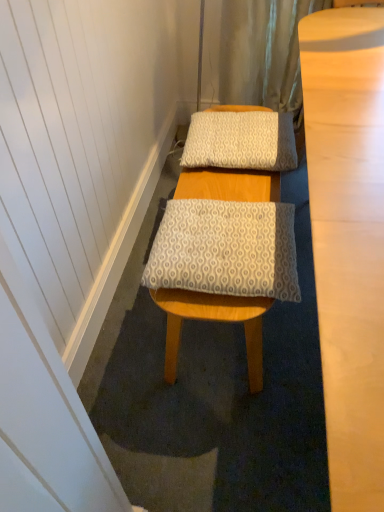
This screenshot has width=384, height=512. What do you see at coordinates (225, 249) in the screenshot?
I see `patterned fabric pillow at center, acting as the second pillow starting from the back` at bounding box center [225, 249].

Where is `patterned fabric pillow at center, the second pillow positioned from the top`? patterned fabric pillow at center, the second pillow positioned from the top is located at coordinates (225, 249).

Is patterned fabric pillow at center, acting as the second pillow starting from the back, at the back of white textured pillow at center, which is the 2th pillow from bottom to top?

white textured pillow at center, which is the 2th pillow from bottom to top, does not have its back to patterned fabric pillow at center, acting as the second pillow starting from the back.

Which of these two, white textured pillow at center, the first pillow in the top-to-bottom sequence, or patterned fabric pillow at center, marked as the 1th pillow in a bottom-to-top arrangement, is thinner?

With smaller width is patterned fabric pillow at center, marked as the 1th pillow in a bottom-to-top arrangement.

From the image's perspective, is white textured pillow at center, acting as the 2th pillow starting from the front, positioned above or below patterned fabric pillow at center, acting as the second pillow starting from the back?

white textured pillow at center, acting as the 2th pillow starting from the front, is above patterned fabric pillow at center, acting as the second pillow starting from the back.

Which object is further away from the camera taking this photo, white textured pillow at center, which is the 2th pillow from bottom to top, or patterned fabric pillow at center, the first pillow when ordered from front to back?

Positioned behind is white textured pillow at center, which is the 2th pillow from bottom to top.

Would you say white textured bath mat at center is inside or outside white textured pillow at center, which is the 1th pillow from back to front?

white textured bath mat at center cannot be found inside white textured pillow at center, which is the 1th pillow from back to front.

Which of these two, white textured bath mat at center or white textured pillow at center, the first pillow in the top-to-bottom sequence, is bigger?

white textured bath mat at center is bigger.

Between white textured bath mat at center and white textured pillow at center, the first pillow in the top-to-bottom sequence, which one appears on the left side from the viewer's perspective?

Positioned to the left is white textured pillow at center, the first pillow in the top-to-bottom sequence.

Is point (193, 272) in front of point (302, 173)?

That is True.

Is white textured bath mat at center a part of patterned fabric pillow at center, the second pillow positioned from the top?

No, white textured bath mat at center is not surrounded by patterned fabric pillow at center, the second pillow positioned from the top.

Could you tell me if patterned fabric pillow at center, marked as the 1th pillow in a bottom-to-top arrangement, is turned towards white textured bath mat at center?

No, patterned fabric pillow at center, marked as the 1th pillow in a bottom-to-top arrangement, does not turn towards white textured bath mat at center.

In terms of width, does patterned fabric pillow at center, the first pillow when ordered from front to back, look wider or thinner when compared to white textured bath mat at center?

In the image, patterned fabric pillow at center, the first pillow when ordered from front to back, appears to be more narrow than white textured bath mat at center.

Which is correct: patterned fabric pillow at center, marked as the 1th pillow in a bottom-to-top arrangement, is inside white textured pillow at center, which is the 1th pillow from back to front, or outside of it?

patterned fabric pillow at center, marked as the 1th pillow in a bottom-to-top arrangement, exists outside the volume of white textured pillow at center, which is the 1th pillow from back to front.

Does patterned fabric pillow at center, marked as the 1th pillow in a bottom-to-top arrangement, have a larger size compared to white textured pillow at center, which is the 1th pillow from back to front?

Incorrect, patterned fabric pillow at center, marked as the 1th pillow in a bottom-to-top arrangement, is not larger than white textured pillow at center, which is the 1th pillow from back to front.

How many degrees apart are the facing directions of patterned fabric pillow at center, the first pillow when ordered from front to back, and white textured pillow at center, which is the 1th pillow from back to front?

The facing directions of patterned fabric pillow at center, the first pillow when ordered from front to back, and white textured pillow at center, which is the 1th pillow from back to front, are 0.000383 degrees apart.

Could you measure the distance between patterned fabric pillow at center, the second pillow positioned from the top, and white textured pillow at center, which is the 1th pillow from back to front?

patterned fabric pillow at center, the second pillow positioned from the top, and white textured pillow at center, which is the 1th pillow from back to front, are 15.82 inches apart.

From the image's perspective, is white textured pillow at center, which is the 1th pillow from back to front, located beneath white textured bath mat at center?

No, from the image's perspective, white textured pillow at center, which is the 1th pillow from back to front, is not beneath white textured bath mat at center.

Which is less distant, (231, 143) or (267, 321)?

Point (231, 143) appears to be closer to the viewer than point (267, 321).

Is white textured pillow at center, which is the 1th pillow from back to front, positioned with its back to white textured bath mat at center?

No, white textured pillow at center, which is the 1th pillow from back to front, is not facing away from white textured bath mat at center.

Considering the relative positions of white textured bath mat at center and patterned fabric pillow at center, acting as the second pillow starting from the back, in the image provided, is white textured bath mat at center behind patterned fabric pillow at center, acting as the second pillow starting from the back,?

Yes, white textured bath mat at center is further from the viewer.

In terms of width, does white textured bath mat at center look wider or thinner when compared to patterned fabric pillow at center, the second pillow positioned from the top?

white textured bath mat at center is wider than patterned fabric pillow at center, the second pillow positioned from the top.

Could you tell me if white textured bath mat at center is facing patterned fabric pillow at center, the second pillow positioned from the top?

No, white textured bath mat at center does not turn towards patterned fabric pillow at center, the second pillow positioned from the top.

From a real-world perspective, which is physically below, white textured bath mat at center or patterned fabric pillow at center, acting as the second pillow starting from the back?

white textured bath mat at center is physically lower.

The image size is (384, 512). Identify the location of pillow on the left of white textured pillow at center, which is the 2th pillow from bottom to top. (225, 249).

This screenshot has height=512, width=384. Identify the location of pillow that appears behind the white textured bath mat at center. (x=241, y=141).

From the image, which object appears to be nearer to patterned fabric pillow at center, acting as the second pillow starting from the back, white textured bath mat at center or white textured pillow at center, the first pillow in the top-to-bottom sequence?

Based on the image, white textured pillow at center, the first pillow in the top-to-bottom sequence, appears to be nearer to patterned fabric pillow at center, acting as the second pillow starting from the back.

Based on their spatial positions, is patterned fabric pillow at center, the second pillow positioned from the top, or white textured bath mat at center further from white textured pillow at center, which is the 2th pillow from bottom to top?

white textured bath mat at center is further to white textured pillow at center, which is the 2th pillow from bottom to top.

When comparing their distances from white textured bath mat at center, does patterned fabric pillow at center, the first pillow when ordered from front to back, or white textured pillow at center, the first pillow in the top-to-bottom sequence, seem further?

The object further to white textured bath mat at center is white textured pillow at center, the first pillow in the top-to-bottom sequence.

Considering their positions, is white textured bath mat at center positioned further to white textured pillow at center, which is the 1th pillow from back to front, than patterned fabric pillow at center, marked as the 1th pillow in a bottom-to-top arrangement?

Based on the image, white textured bath mat at center appears to be further to white textured pillow at center, which is the 1th pillow from back to front.

From the picture: Based on their spatial positions, is white textured pillow at center, which is the 2th pillow from bottom to top, or white textured bath mat at center further from patterned fabric pillow at center, marked as the 1th pillow in a bottom-to-top arrangement?

white textured bath mat at center lies further to patterned fabric pillow at center, marked as the 1th pillow in a bottom-to-top arrangement, than the other object.

From the image, which object appears to be farther from white textured bath mat at center, white textured pillow at center, which is the 1th pillow from back to front, or patterned fabric pillow at center, acting as the second pillow starting from the back?

The object further to white textured bath mat at center is white textured pillow at center, which is the 1th pillow from back to front.

Find the location of `bath mat between white textured pillow at center, which is the 2th pillow from bottom to top, and patterned fabric pillow at center, marked as the 1th pillow in a bottom-to-top arrangement, vertically`. bath mat between white textured pillow at center, which is the 2th pillow from bottom to top, and patterned fabric pillow at center, marked as the 1th pillow in a bottom-to-top arrangement, vertically is located at coordinates (212, 392).